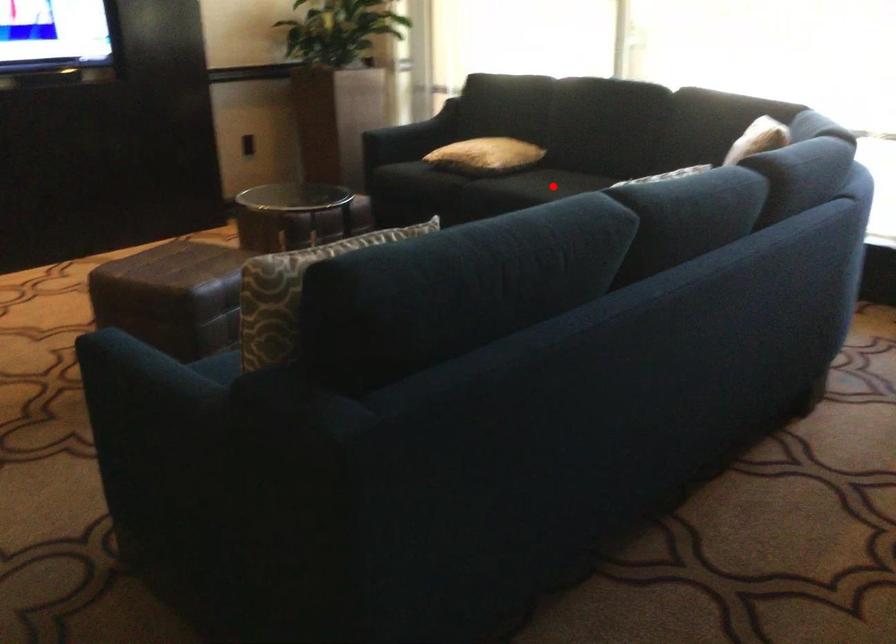
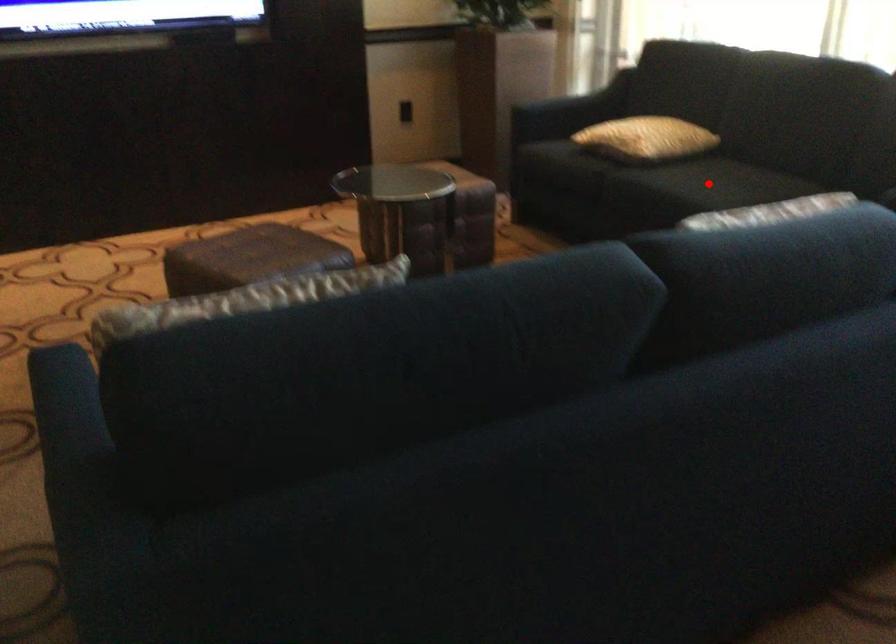
Based on the photo, I am providing you with two images of the same scene from different viewpoints. A red point is marked on the first image and another point is marked on the second image. Is the red point in image1 aligned with the point shown in image2?

Yes